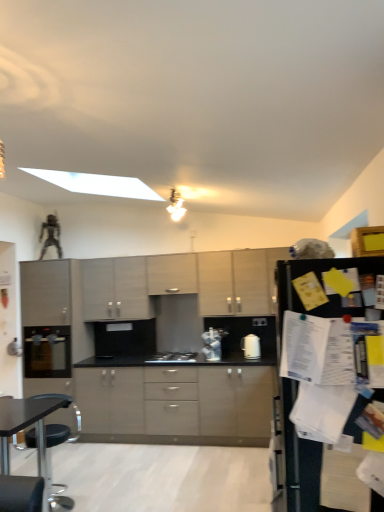
Question: Does matte black oven at left, which appears as the second appliance when viewed from the front, have a lesser width compared to matte gray cabinets at center, positioned as the second cabinetry in top-to-bottom order?

Choices:
 (A) yes
 (B) no

Answer: (B)

Question: Are matte black oven at left, which is the first appliance in back-to-front order, and matte gray cabinets at center, positioned as the third cabinetry in bottom-to-top order, located far from each other?

Choices:
 (A) no
 (B) yes

Answer: (B)

Question: Is matte black oven at left, which appears as the second appliance when viewed from the front, looking in the opposite direction of matte gray cabinets at center, positioned as the second cabinetry in top-to-bottom order?

Choices:
 (A) no
 (B) yes

Answer: (A)

Question: Is matte black oven at left, which appears as the second appliance when viewed from the right, shorter than matte gray cabinets at center, positioned as the second cabinetry in top-to-bottom order?

Choices:
 (A) yes
 (B) no

Answer: (A)

Question: From the image's perspective, is matte black oven at left, which appears as the second appliance when viewed from the right, on matte gray cabinets at center, positioned as the second cabinetry in top-to-bottom order?

Choices:
 (A) yes
 (B) no

Answer: (B)

Question: Looking at their shapes, would you say matte gray cabinet at center, placed as the 1th cabinetry when sorted from top to bottom, is wider or thinner than satin silver toaster at center, which ranks as the 1th appliance in right-to-left order?

Choices:
 (A) thin
 (B) wide

Answer: (B)

Question: Looking at the image, does matte gray cabinet at center, placed as the 1th cabinetry when sorted from top to bottom, seem bigger or smaller compared to satin silver toaster at center, which ranks as the 1th appliance in right-to-left order?

Choices:
 (A) small
 (B) big

Answer: (B)

Question: Is matte gray cabinet at center, placed as the 1th cabinetry when sorted from top to bottom, situated inside satin silver toaster at center, the second appliance when ordered from back to front, or outside?

Choices:
 (A) inside
 (B) outside

Answer: (B)

Question: Considering their positions, is matte gray cabinet at center, placed as the 1th cabinetry when sorted from top to bottom, located in front of or behind satin silver toaster at center, which ranks as the 1th appliance in right-to-left order?

Choices:
 (A) front
 (B) behind

Answer: (B)

Question: From a real-world perspective, is matte gray cabinet at center, positioned as the second cabinetry in bottom-to-top order, above or below matte gray cabinet at center, the fourth cabinetry positioned from the bottom?

Choices:
 (A) above
 (B) below

Answer: (B)

Question: Would you say matte gray cabinet at center, positioned as the second cabinetry in bottom-to-top order, is inside or outside matte gray cabinet at center, placed as the 1th cabinetry when sorted from top to bottom?

Choices:
 (A) outside
 (B) inside

Answer: (A)

Question: Is matte gray cabinet at center, positioned as the second cabinetry in bottom-to-top order, wider or thinner than matte gray cabinet at center, the fourth cabinetry positioned from the bottom?

Choices:
 (A) wide
 (B) thin

Answer: (B)

Question: From the image's perspective, relative to matte gray cabinet at center, placed as the 1th cabinetry when sorted from top to bottom, is matte gray cabinet at center, acting as the third cabinetry starting from the top, above or below?

Choices:
 (A) above
 (B) below

Answer: (B)

Question: In terms of width, does matte black oven at left, arranged as the 1th appliance when viewed from the left, look wider or thinner when compared to matte gray cabinets at center, marked as the 4th cabinetry in a top-to-bottom arrangement?

Choices:
 (A) thin
 (B) wide

Answer: (B)

Question: From a real-world perspective, is matte black oven at left, which is the first appliance in back-to-front order, physically located above or below matte gray cabinets at center, marked as the 4th cabinetry in a top-to-bottom arrangement?

Choices:
 (A) above
 (B) below

Answer: (A)